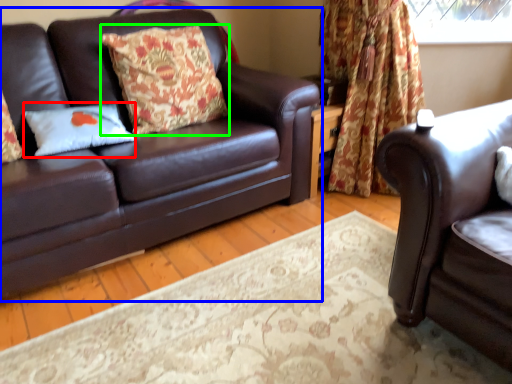
Question: Based on their relative distances, which object is nearer to pillow (highlighted by a red box)? Choose from studio couch (highlighted by a blue box) and pillow (highlighted by a green box).

Choices:
 (A) studio couch
 (B) pillow

Answer: (A)